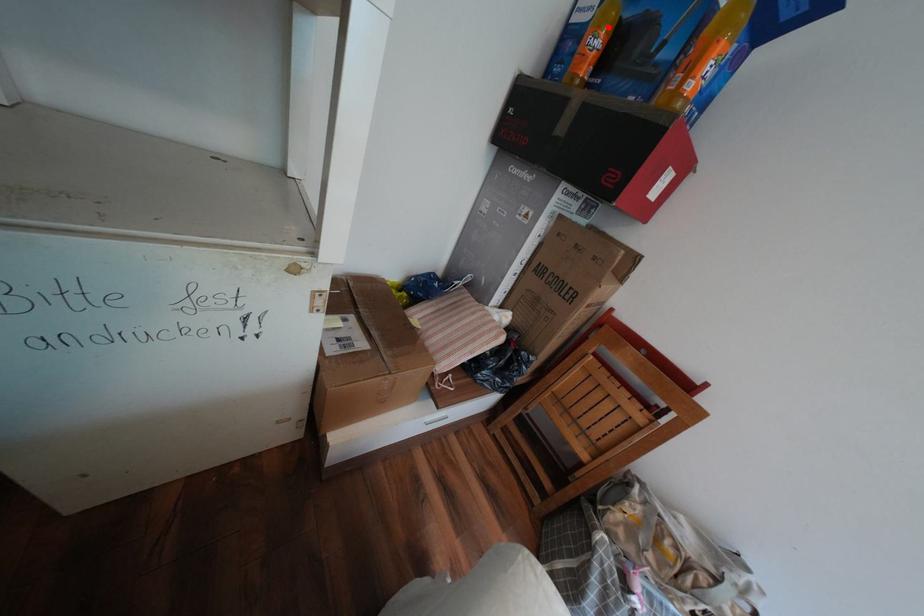
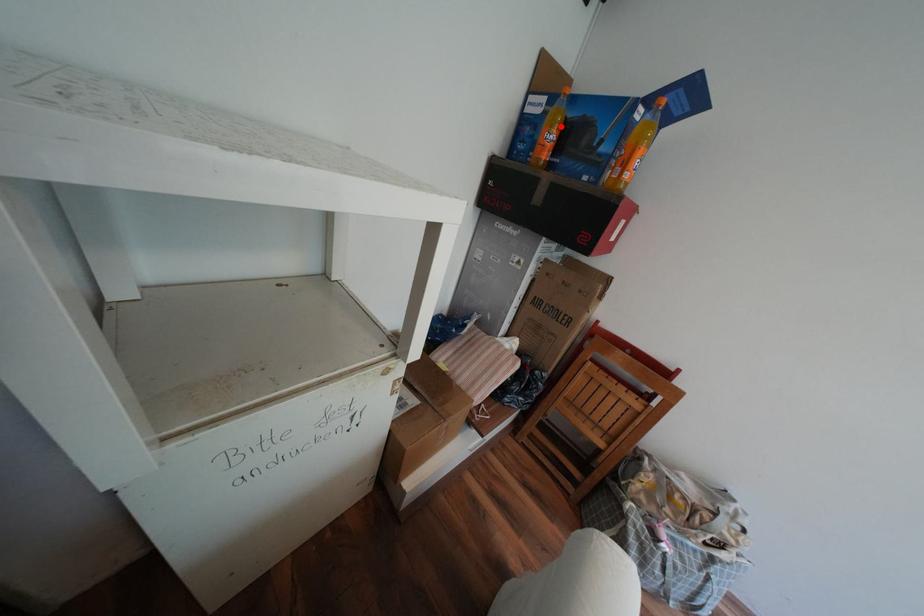
I am providing you with two images of the same scene from different viewpoints. A red point is marked on the first image and another point is marked on the second image. Is the marked point in image1 the same physical position as the marked point in image2?

Yes